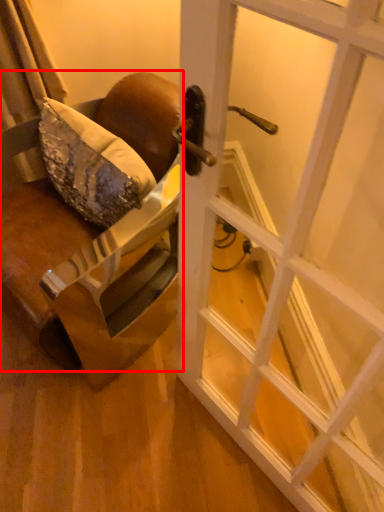
Question: Observing the image, what is the correct spatial positioning of chair (annotated by the red box) in reference to door?

Choices:
 (A) left
 (B) right

Answer: (A)